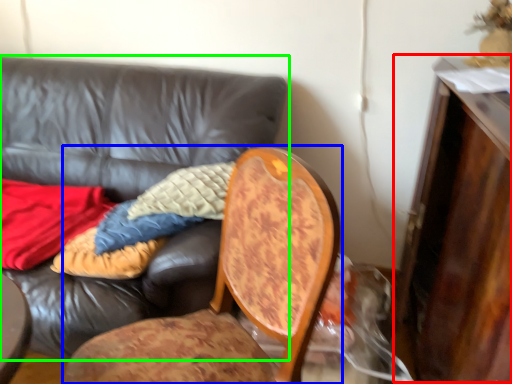
Question: Based on their relative distances, which object is nearer to dresser (highlighted by a red box)? Choose from chair (highlighted by a blue box) and studio couch (highlighted by a green box).

Choices:
 (A) chair
 (B) studio couch

Answer: (A)